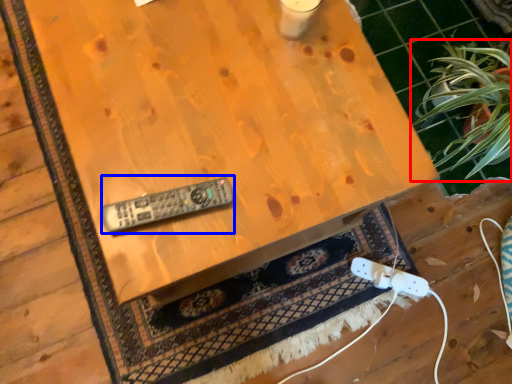
Question: Among these objects, which one is nearest to the camera, houseplant (highlighted by a red box) or control (highlighted by a blue box)?

Choices:
 (A) houseplant
 (B) control

Answer: (B)